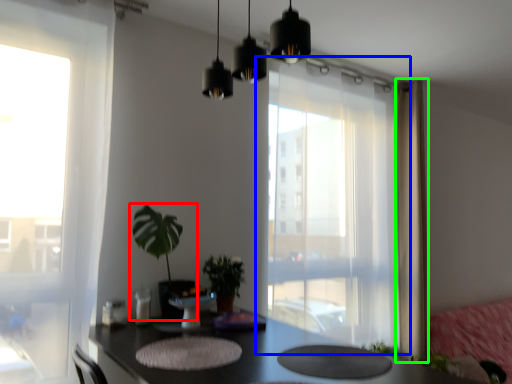
Question: Based on their relative distances, which object is nearer to houseplant (highlighted by a red box)? Choose from window (highlighted by a blue box) and curtain (highlighted by a green box).

Choices:
 (A) window
 (B) curtain

Answer: (A)